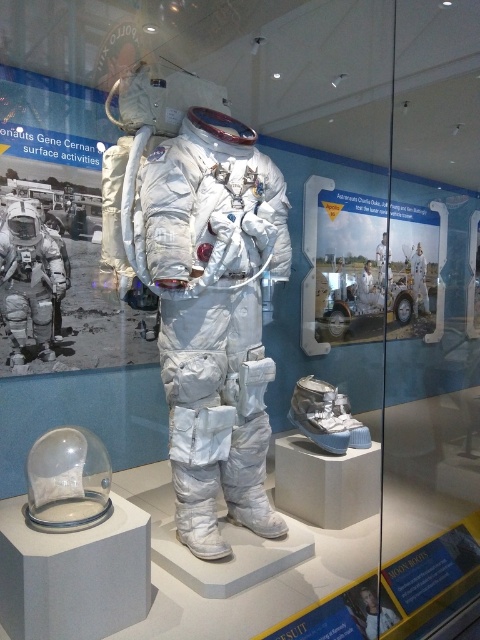
Question: Does white metallic spacesuit at center appear under matte white spacesuit at center?

Choices:
 (A) no
 (B) yes

Answer: (B)

Question: Does matte white spacesuit at center have a greater width compared to white matte spacesuit at center?

Choices:
 (A) no
 (B) yes

Answer: (B)

Question: Based on their relative distances, which object is farther from the matte white spacesuit at center?

Choices:
 (A) white metallic spacesuit at center
 (B) white matte spacesuit at center

Answer: (B)

Question: Which of the following is the farthest from the observer?

Choices:
 (A) (178, 230)
 (B) (31, 241)

Answer: (B)

Question: Estimate the real-world distances between objects in this image. Which object is closer to the white matte spacesuit at center?

Choices:
 (A) matte white spacesuit at center
 (B) white metallic spacesuit at center

Answer: (B)

Question: Is white metallic spacesuit at center bigger than white matte spacesuit at center?

Choices:
 (A) no
 (B) yes

Answer: (B)